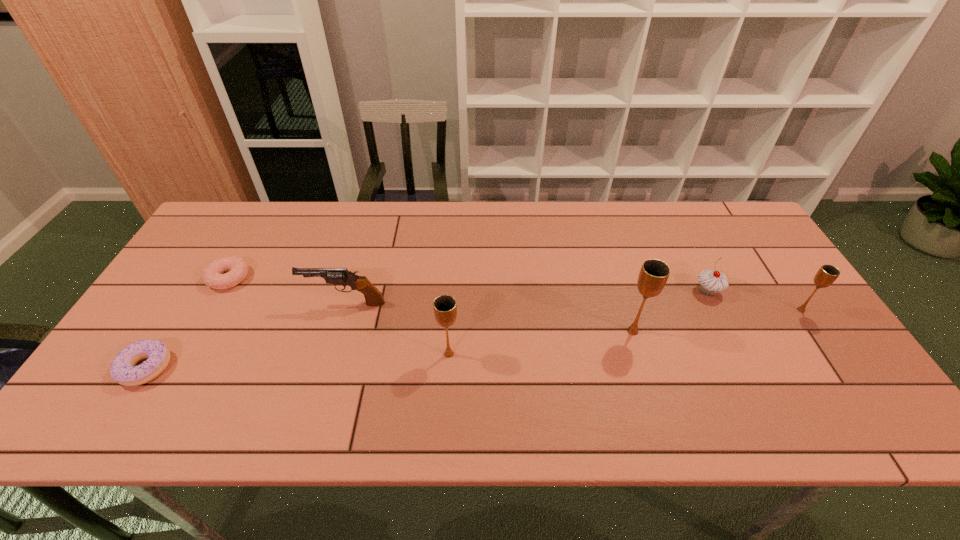
The height and width of the screenshot is (540, 960). In order to click on the nearest chalice in this screenshot , I will do `click(445, 309)`.

At what (x,y) coordinates should I click in order to perform the action: click on the sixth shortest object. Please return your answer as a coordinate pair (x, y). The width and height of the screenshot is (960, 540). Looking at the image, I should click on (445, 309).

At what (x,y) coordinates should I click in order to perform the action: click on the tallest object. Please return your answer as a coordinate pair (x, y). This screenshot has height=540, width=960. Looking at the image, I should click on (654, 273).

Where is `the third object from right to left`? Image resolution: width=960 pixels, height=540 pixels. the third object from right to left is located at coordinates (654, 273).

What are the coordinates of `the farthest chalice` in the screenshot? It's located at coord(827,274).

Locate an element on the screen. The width and height of the screenshot is (960, 540). the rightmost object is located at coordinates (827, 274).

Locate an element on the screen. cupcake is located at coordinates (711, 281).

Locate an element on the screen. The height and width of the screenshot is (540, 960). gun is located at coordinates (338, 276).

Locate an element on the screen. the farther doughnut is located at coordinates (213, 276).

What are the coordinates of `the nearer doughnut` in the screenshot? It's located at (122, 369).